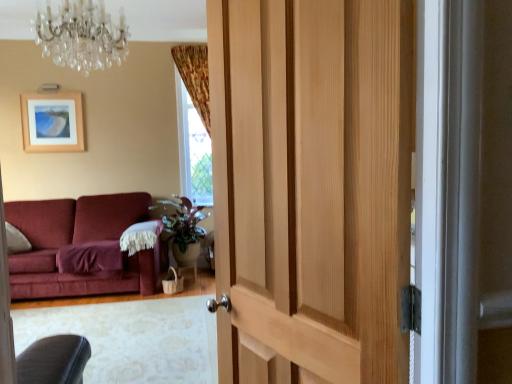
What are the coordinates of `green matte plant at center` in the screenshot? It's located at (182, 222).

This screenshot has width=512, height=384. What do you see at coordinates (52, 122) in the screenshot?
I see `wooden picture frame at upper left` at bounding box center [52, 122].

Image resolution: width=512 pixels, height=384 pixels. In order to click on green matte plant at center in this screenshot , I will do `click(182, 222)`.

From the image's perspective, between green matte plant at center and crystal glass chandelier at upper center, which one is located above?

crystal glass chandelier at upper center appears higher in the image.

Is the depth of green matte plant at center greater than that of crystal glass chandelier at upper center?

Yes, green matte plant at center is further from the viewer.

Does green matte plant at center have a lesser width compared to crystal glass chandelier at upper center?

Correct, the width of green matte plant at center is less than that of crystal glass chandelier at upper center.

Between point (180, 250) and point (85, 46), which one is positioned behind?

The point (180, 250) is behind.

Can wooden picture frame at upper left be found inside crystal glass chandelier at upper center?

No, wooden picture frame at upper left is not surrounded by crystal glass chandelier at upper center.

Relative to wooden picture frame at upper left, is crystal glass chandelier at upper center in front or behind?

Visually, crystal glass chandelier at upper center is located in front of wooden picture frame at upper left.

Can you confirm if crystal glass chandelier at upper center is thinner than wooden picture frame at upper left?

No, crystal glass chandelier at upper center is not thinner than wooden picture frame at upper left.

From a real-world perspective, between crystal glass chandelier at upper center and wooden picture frame at upper left, who is vertically higher?

In real-world perspective, crystal glass chandelier at upper center is above.

Between crystal glass chandelier at upper center and green matte plant at center, which one has more height?

With more height is green matte plant at center.

From a real-world perspective, is crystal glass chandelier at upper center under green matte plant at center?

No, from a real-world perspective, crystal glass chandelier at upper center is not under green matte plant at center.

What's the angular difference between crystal glass chandelier at upper center and green matte plant at center's facing directions?

The angle between the facing direction of crystal glass chandelier at upper center and the facing direction of green matte plant at center is 2.14 degrees.

This screenshot has width=512, height=384. I want to click on chandelier behind the natural wood door at center, so click(82, 36).

Which point is more forward, (223, 121) or (48, 17)?

The point (223, 121) is closer to the camera.

Is natural wood door at center not within crystal glass chandelier at upper center?

Yes.

Considering the sizes of objects natural wood door at center and crystal glass chandelier at upper center in the image provided, who is wider, natural wood door at center or crystal glass chandelier at upper center?

With larger width is crystal glass chandelier at upper center.

At what (x,y) coordinates should I click in order to perform the action: click on door below the crystal glass chandelier at upper center (from a real-world perspective). Please return your answer as a coordinate pair (x, y). The height and width of the screenshot is (384, 512). Looking at the image, I should click on (311, 187).

From the image's perspective, does crystal glass chandelier at upper center appear lower than natural wood door at center?

No.

Would you say crystal glass chandelier at upper center is inside or outside natural wood door at center?

crystal glass chandelier at upper center is not inside natural wood door at center, it's outside.

Is natural wood door at center at the back of crystal glass chandelier at upper center?

That's not correct — crystal glass chandelier at upper center is not looking away from natural wood door at center.

Between natural wood door at center and wooden picture frame at upper left, which one has more height?

natural wood door at center is taller.

Would you say natural wood door at center is to the left or to the right of wooden picture frame at upper left in the picture?

Based on their positions, natural wood door at center is located to the right of wooden picture frame at upper left.

Does natural wood door at center turn towards wooden picture frame at upper left?

No, natural wood door at center does not turn towards wooden picture frame at upper left.

Would you say natural wood door at center is a long distance from wooden picture frame at upper left?

Yes.

Which object is more forward, natural wood door at center or green matte plant at center?

natural wood door at center is in front.

Which object is positioned more to the left, natural wood door at center or green matte plant at center?

Positioned to the left is green matte plant at center.

Can you tell me how much natural wood door at center and green matte plant at center differ in facing direction?

117 degrees.

Find the location of a particular element. The image size is (512, 384). chandelier on the left of the green matte plant at center is located at coordinates (82, 36).

Where is `picture frame that appears below the crystal glass chandelier at upper center (from a real-world perspective)`? Image resolution: width=512 pixels, height=384 pixels. picture frame that appears below the crystal glass chandelier at upper center (from a real-world perspective) is located at coordinates (52, 122).

When comparing their distances from crystal glass chandelier at upper center, does natural wood door at center or wooden picture frame at upper left seem further?

Among the two, wooden picture frame at upper left is located further to crystal glass chandelier at upper center.

Considering their positions, is crystal glass chandelier at upper center positioned further to wooden picture frame at upper left than natural wood door at center?

natural wood door at center is positioned further to the anchor wooden picture frame at upper left.

When comparing their distances from green matte plant at center, does wooden picture frame at upper left or crystal glass chandelier at upper center seem further?

crystal glass chandelier at upper center.

From the picture: Estimate the real-world distances between objects in this image. Which object is closer to green matte plant at center, wooden picture frame at upper left or natural wood door at center?

wooden picture frame at upper left is closer to green matte plant at center.

When comparing their distances from crystal glass chandelier at upper center, does wooden picture frame at upper left or green matte plant at center seem closer?

Among the two, green matte plant at center is located nearer to crystal glass chandelier at upper center.

Based on their spatial positions, is wooden picture frame at upper left or natural wood door at center closer to crystal glass chandelier at upper center?

Among the two, natural wood door at center is located nearer to crystal glass chandelier at upper center.

Looking at the image, which one is located further to wooden picture frame at upper left, crystal glass chandelier at upper center or green matte plant at center?

The object further to wooden picture frame at upper left is crystal glass chandelier at upper center.

Looking at the image, which one is located further to natural wood door at center, green matte plant at center or wooden picture frame at upper left?

wooden picture frame at upper left lies further to natural wood door at center than the other object.

This screenshot has height=384, width=512. I want to click on plant positioned between natural wood door at center and wooden picture frame at upper left from near to far, so click(182, 222).

You are a GUI agent. You are given a task and a screenshot of the screen. Output one action in this format:
    pyautogui.click(x=<x>, y=<y>)
    Task: Click on the chandelier positioned between natural wood door at center and green matte plant at center from near to far
    
    Given the screenshot: What is the action you would take?
    pyautogui.click(x=82, y=36)

You are a GUI agent. You are given a task and a screenshot of the screen. Output one action in this format:
    pyautogui.click(x=<x>, y=<y>)
    Task: Click on the chandelier located between natural wood door at center and wooden picture frame at upper left in the depth direction
    This screenshot has height=384, width=512.
    Given the screenshot: What is the action you would take?
    pyautogui.click(x=82, y=36)

Locate an element on the screen. plant between crystal glass chandelier at upper center and wooden picture frame at upper left along the z-axis is located at coordinates (182, 222).